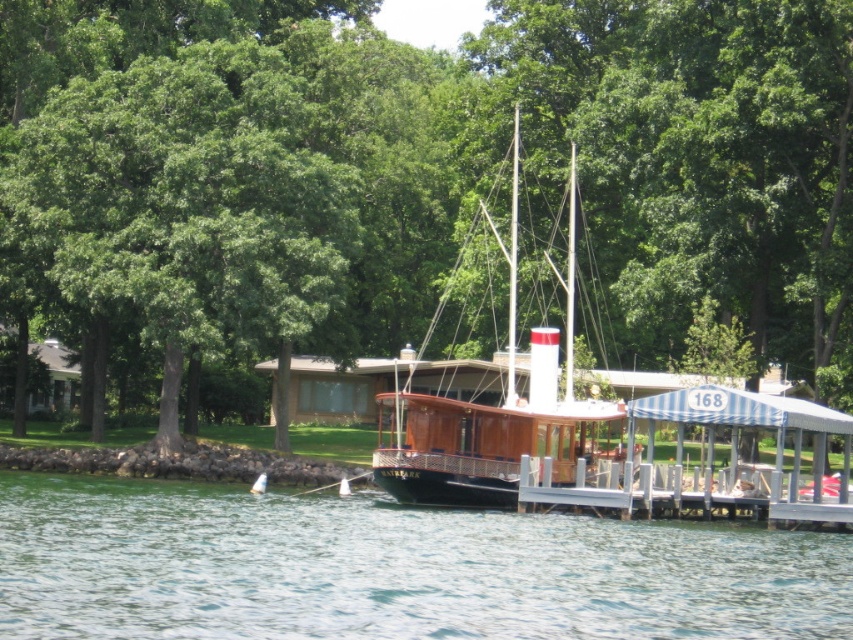
Question: Estimate the real-world distances between objects in this image. Which object is farther from the white striped wood dock at center?

Choices:
 (A) green leafy tree at center
 (B) clear water at center
 (C) wooden boat at center

Answer: (A)

Question: From the image, what is the correct spatial relationship of green leafy tree at center in relation to wooden boat at center?

Choices:
 (A) left
 (B) right

Answer: (A)

Question: Is green leafy tree at center in front of wooden boat at center?

Choices:
 (A) yes
 (B) no

Answer: (B)

Question: Which object is farther from the camera taking this photo?

Choices:
 (A) white striped wood dock at center
 (B) wooden boat at center
 (C) clear water at center
 (D) green leafy tree at center

Answer: (D)

Question: Which is farther from the white striped wood dock at center?

Choices:
 (A) green leafy tree at center
 (B) wooden boat at center

Answer: (A)

Question: Is clear water at center to the right of wooden boat at center from the viewer's perspective?

Choices:
 (A) yes
 (B) no

Answer: (B)